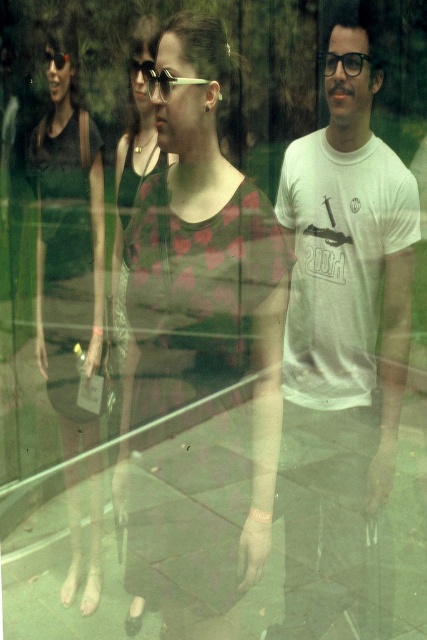
You are standing in the scene and see two points marked in the image. The first point is at coordinates point (193, 556) and the second point is at point (312, 307). Which point is closer to you?

Point (193, 556) is in front of point (312, 307), so it is closer to you.